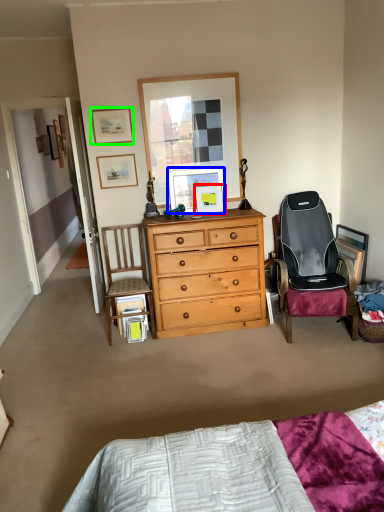
Question: Which object is positioned farthest from picture frame (highlighted by a red box)? Select from picture frame (highlighted by a blue box) and picture frame (highlighted by a green box).

Choices:
 (A) picture frame
 (B) picture frame

Answer: (B)